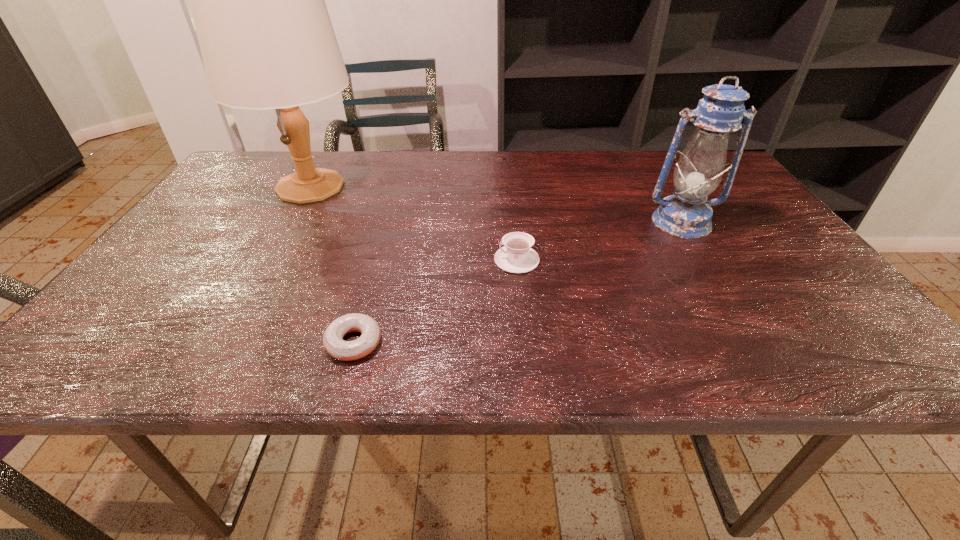
Where is `free region at the near edge of the desktop`? The height and width of the screenshot is (540, 960). free region at the near edge of the desktop is located at coordinates (492, 340).

Locate an element on the screen. The height and width of the screenshot is (540, 960). free spot at the right edge of the desktop is located at coordinates click(749, 237).

In order to click on vacant region at the near left corner in this screenshot , I will do `click(98, 338)`.

Locate an element on the screen. This screenshot has height=540, width=960. free point between the doughnut and the second shortest object is located at coordinates (435, 301).

At what (x,y) coordinates should I click in order to perform the action: click on vacant space that is in between the table lamp and the lantern. Please return your answer as a coordinate pair (x, y). The image size is (960, 540). Looking at the image, I should click on (495, 204).

Find the location of a particular element. The image size is (960, 540). vacant region between the shortest object and the second shortest object is located at coordinates (435, 301).

At what (x,y) coordinates should I click in order to perform the action: click on vacant region between the nearest object and the table lamp. Please return your answer as a coordinate pair (x, y). Looking at the image, I should click on (332, 265).

In order to click on vacant region between the doughnut and the lantern in this screenshot , I will do `click(517, 282)`.

I want to click on empty location between the second object from right to left and the shortest object, so click(435, 301).

Where is `vacant space that is in between the teacup and the tallest object`? The height and width of the screenshot is (540, 960). vacant space that is in between the teacup and the tallest object is located at coordinates [x=414, y=223].